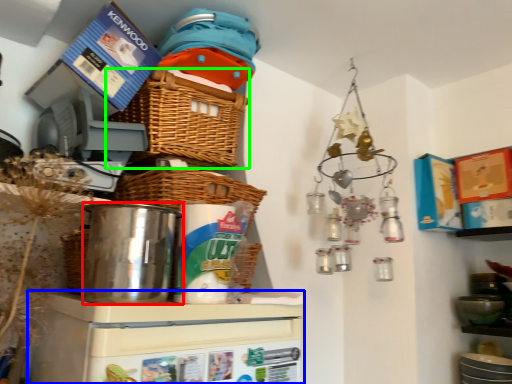
Question: Which object is positioned farthest from appliance (highlighted by a red box)? Select from appliance (highlighted by a blue box) and basket (highlighted by a green box).

Choices:
 (A) appliance
 (B) basket

Answer: (B)